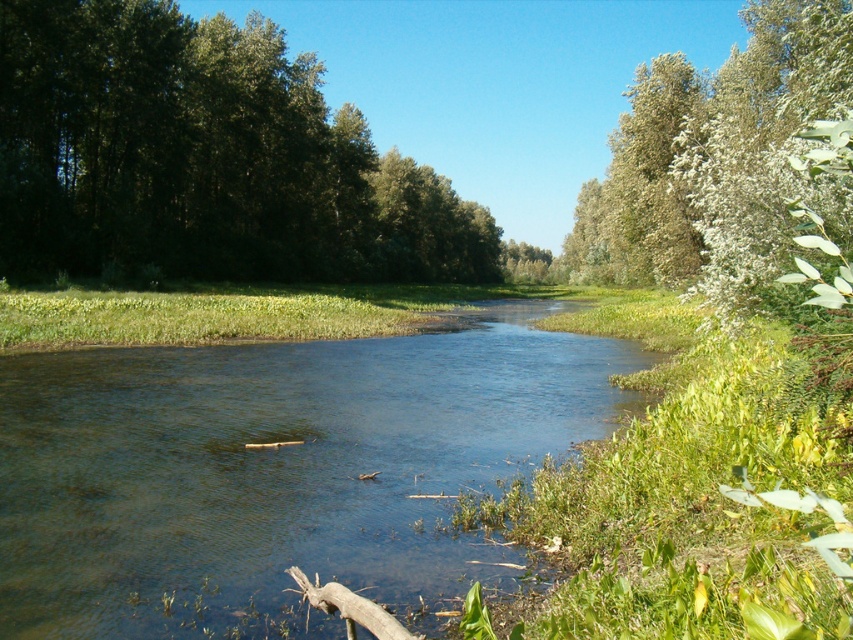
Question: Among these points, which one is nearest to the camera?

Choices:
 (A) (358, 177)
 (B) (88, 618)
 (C) (596, 211)

Answer: (B)

Question: In this image, where is green leafy trees at left located relative to green fuzzy bush at upper right?

Choices:
 (A) below
 (B) above

Answer: (B)

Question: Which point is closer to the camera?

Choices:
 (A) clear water at center
 (B) green leafy trees at left

Answer: (A)

Question: Can you confirm if clear water at center is positioned to the right of green leafy trees at left?

Choices:
 (A) no
 (B) yes

Answer: (B)

Question: Is green leafy trees at left behind green fuzzy bush at upper right?

Choices:
 (A) no
 (B) yes

Answer: (B)

Question: Among these objects, which one is nearest to the camera?

Choices:
 (A) green leafy trees at left
 (B) green fuzzy bush at upper right

Answer: (B)